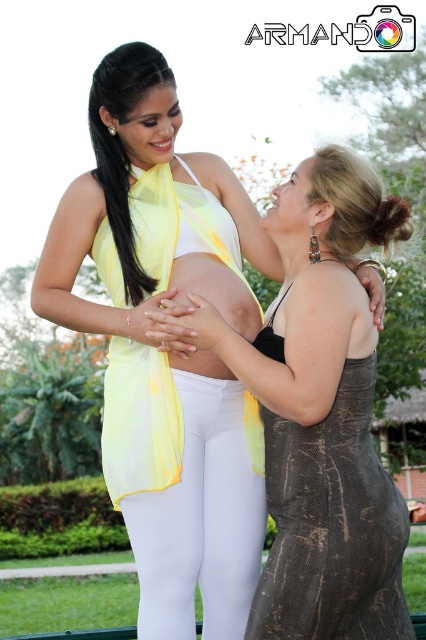
Locate an element on the screen. The width and height of the screenshot is (426, 640). brown textured dress at center is located at coordinates point(331,525).

Looking at this image, is brown textured dress at center taller than matte yellow skin at center?

Indeed, brown textured dress at center has a greater height compared to matte yellow skin at center.

Does point (273, 564) come behind point (178, 339)?

No.

Locate an element on the screen. brown textured dress at center is located at coordinates pos(331,525).

Between brown textured dress at center and white matte leggings at center, which one appears on the left side from the viewer's perspective?

Positioned to the left is white matte leggings at center.

Who is shorter, brown textured dress at center or white matte leggings at center?

brown textured dress at center is shorter.

Does point (316, 465) lie in front of point (242, 628)?

That is True.

This screenshot has height=640, width=426. Find the location of `brown textured dress at center`. brown textured dress at center is located at coordinates (331, 525).

Is white matte leggings at center taller than matte yellow skin at center?

Yes.

Which is in front, point (183, 410) or point (249, 330)?

Point (183, 410)

Locate an element on the screen. The image size is (426, 640). white matte leggings at center is located at coordinates (201, 522).